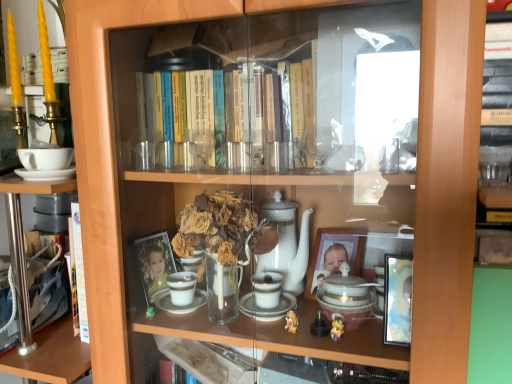
In order to face white ceramic cup at left, should I rotate leftwards or rightwards?

Rotate left and turn 26.255 degrees.

Describe the element at coordinates (46, 158) in the screenshot. I see `white ceramic cup at left` at that location.

Locate an element on the screen. The width and height of the screenshot is (512, 384). white ceramic cup at left is located at coordinates (46, 158).

Locate an element on the screen. This screenshot has width=512, height=384. white ceramic cup at left is located at coordinates (46, 158).